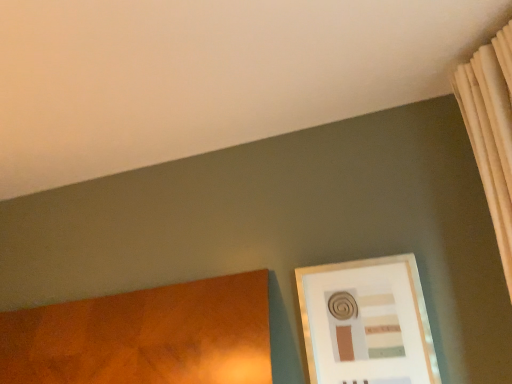
Describe the element at coordinates (366, 322) in the screenshot. I see `white matte picture frame at upper right` at that location.

Locate an element on the screen. This screenshot has width=512, height=384. white matte picture frame at upper right is located at coordinates (366, 322).

Locate an element on the screen. white matte picture frame at upper right is located at coordinates (366, 322).